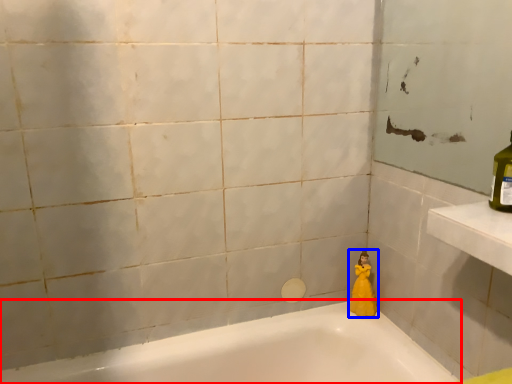
Question: Which object is closer to the camera taking this photo, bathtub (highlighted by a red box) or doll (highlighted by a blue box)?

Choices:
 (A) bathtub
 (B) doll

Answer: (A)